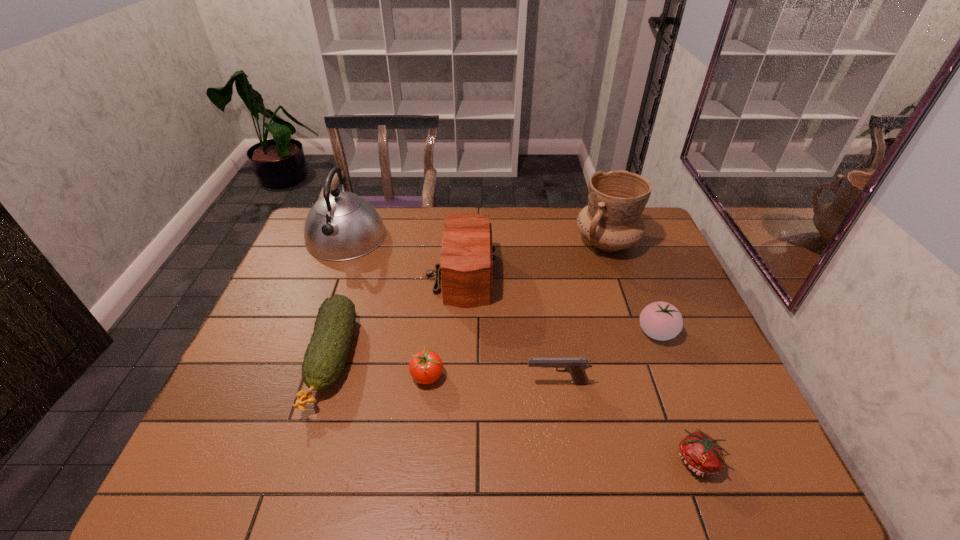
You are a GUI agent. You are given a task and a screenshot of the screen. Output one action in this format:
    pyautogui.click(x=<x>, y=<y>)
    Task: Click on the object at the near edge
    This screenshot has height=540, width=960.
    Given the screenshot: What is the action you would take?
    pyautogui.click(x=699, y=452)

You are a GUI agent. You are given a task and a screenshot of the screen. Output one action in this format:
    pyautogui.click(x=<x>, y=<y>)
    Task: Click on the object that is at the left edge
    This screenshot has height=540, width=960.
    Given the screenshot: What is the action you would take?
    pyautogui.click(x=340, y=226)

Identify the location of pottery situated at the right edge. The image size is (960, 540). (612, 221).

Find the location of a particular element. This screenshot has width=960, height=540. object present at the far left corner is located at coordinates (340, 226).

I want to click on object that is at the far right corner, so click(x=612, y=221).

Image resolution: width=960 pixels, height=540 pixels. What are the coordinates of `object positioned at the near right corner` in the screenshot? It's located at (699, 452).

The image size is (960, 540). Find the location of `free location at the far edge`. free location at the far edge is located at coordinates (555, 223).

In the image, there is a desktop. Identify the location of blank space at the near edge. The image size is (960, 540). (650, 454).

Where is `free space at the left edge`? free space at the left edge is located at coordinates (287, 338).

Where is `vacant space at the right edge of the desktop`? The image size is (960, 540). vacant space at the right edge of the desktop is located at coordinates (682, 366).